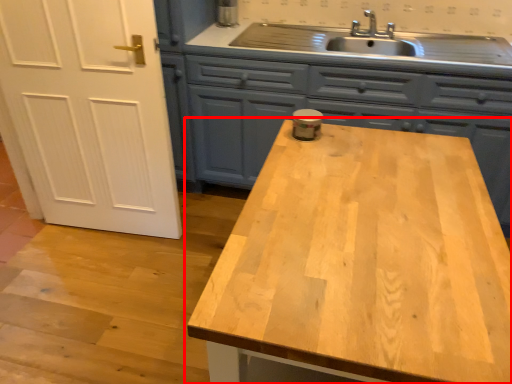
Question: From the image's perspective, where is countertop (annotated by the red box) located in relation to cabinetry in the image?

Choices:
 (A) below
 (B) above

Answer: (A)